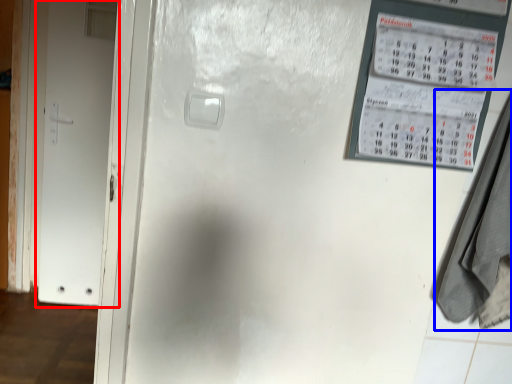
Question: Which object appears farthest to the camera in this image, door (highlighted by a red box) or laundry (highlighted by a blue box)?

Choices:
 (A) door
 (B) laundry

Answer: (A)